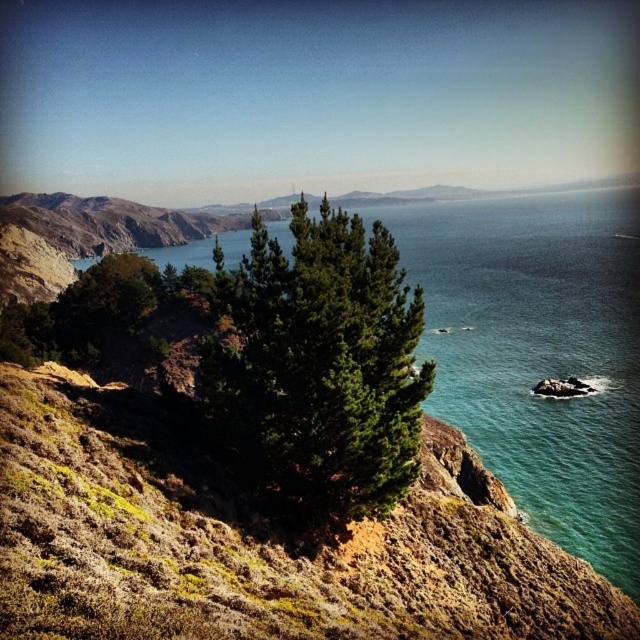
Question: Which object is farther from the camera taking this photo?

Choices:
 (A) green textured tree at center
 (B) greenish-blue water at center

Answer: (B)

Question: Does greenish-blue water at center appear under green textured tree at center?

Choices:
 (A) no
 (B) yes

Answer: (A)

Question: Which object appears farthest from the camera in this image?

Choices:
 (A) greenish-blue water at center
 (B) green textured tree at center

Answer: (A)

Question: Can you confirm if greenish-blue water at center is bigger than green textured tree at center?

Choices:
 (A) no
 (B) yes

Answer: (B)

Question: Where is greenish-blue water at center located in relation to green textured tree at center in the image?

Choices:
 (A) below
 (B) above

Answer: (B)